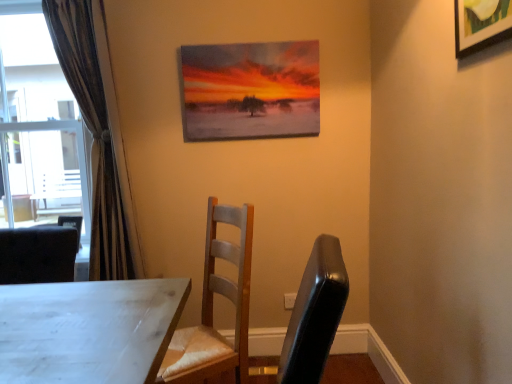
Locate an element on the screen. This screenshot has width=512, height=384. vacant region above oil painting at upper center, acting as the second picture frame starting from the front (from a real-world perspective) is located at coordinates (249, 42).